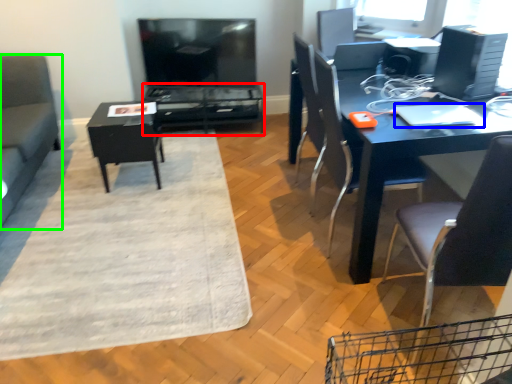
Question: Which object is positioned closest to table (highlighted by a red box)? Select from laptop (highlighted by a blue box) and studio couch (highlighted by a green box).

Choices:
 (A) laptop
 (B) studio couch

Answer: (B)